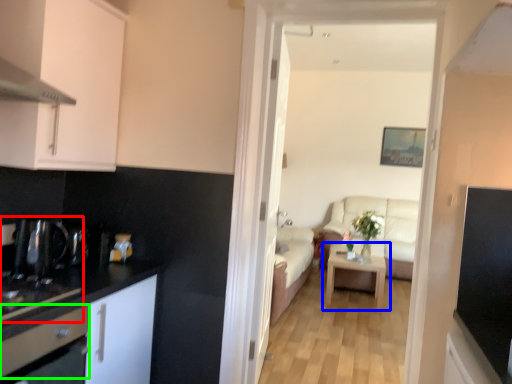
Question: Which is nearer to the sink (highlighted by a red box)? table (highlighted by a blue box) or drawer (highlighted by a green box).

Choices:
 (A) table
 (B) drawer

Answer: (B)